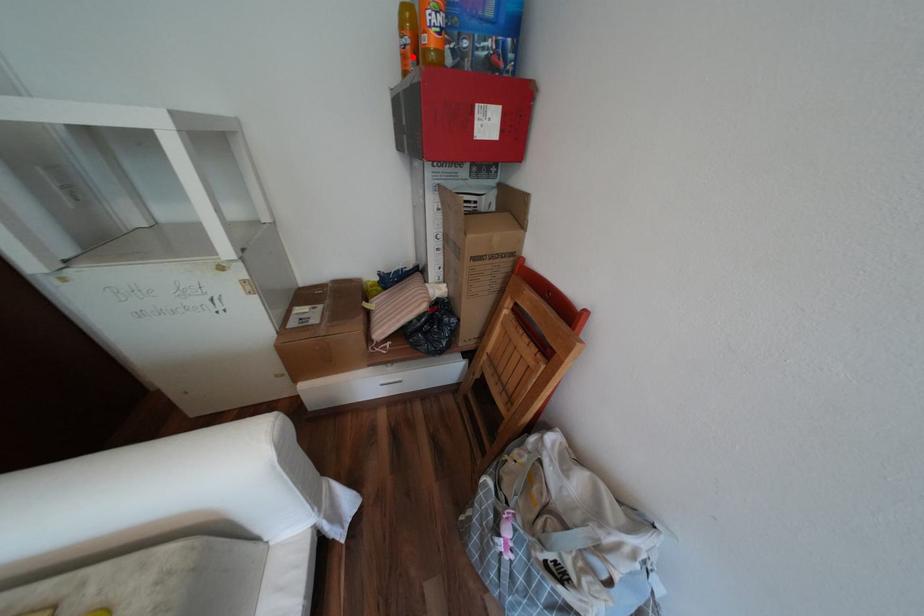
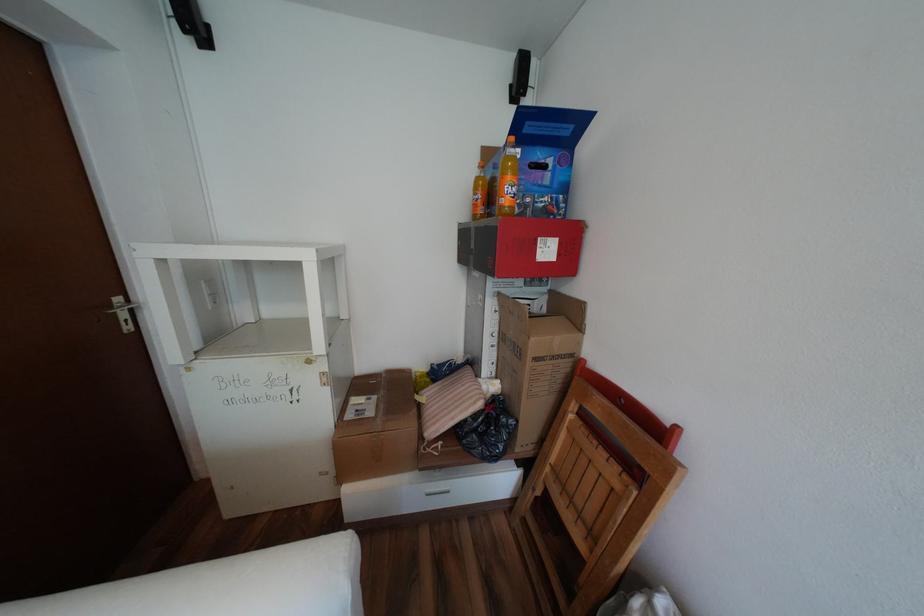
Locate, in the second image, the point that corresponds to the highlighted location in the first image.

(484, 206)